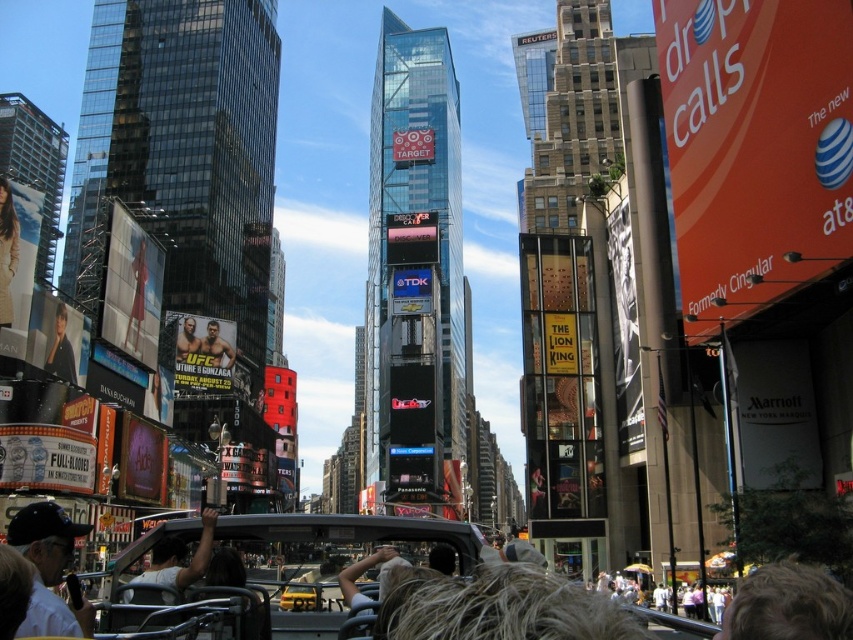
Question: Among these objects, which one is farthest from the camera?

Choices:
 (A) matte black jacket at upper left
 (B) matte black ufc fighter at center
 (C) blue denim jacket at lower left
 (D) muscular man in fighting attire at center

Answer: (D)

Question: Does yellow matte taxi at center have a lesser width compared to matte black ufc fighter at center?

Choices:
 (A) yes
 (B) no

Answer: (B)

Question: Considering the relative positions of black leather jacket at left and muscular man in fighting attire at center in the image provided, where is black leather jacket at left located with respect to muscular man in fighting attire at center?

Choices:
 (A) below
 (B) above

Answer: (B)

Question: Which of these objects is positioned farthest from the muscular man in fighting attire at center?

Choices:
 (A) yellow matte taxi at center
 (B) blonde hair at lower right
 (C) matte black ufc fighter at center

Answer: (B)

Question: Which object is closer to the camera taking this photo?

Choices:
 (A) muscular man in fighting attire at center
 (B) blue denim jacket at lower left
 (C) matte black jacket at upper left

Answer: (B)

Question: Can you confirm if blonde hair at lower right is positioned to the right of muscular man in fighting attire at center?

Choices:
 (A) yes
 (B) no

Answer: (A)